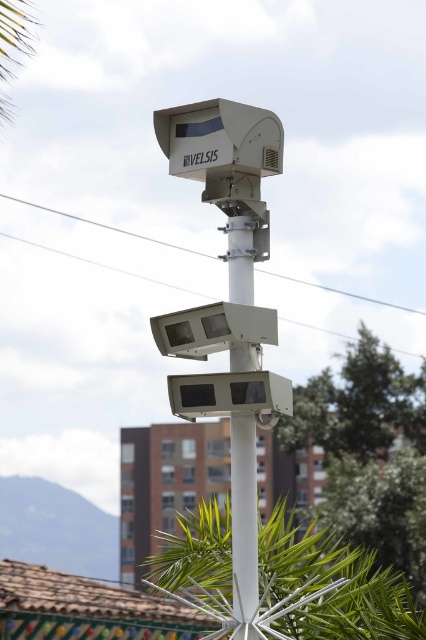
Is white matte pole at center in front of green leafy palm tree at upper left?

Yes, white matte pole at center is closer to the viewer.

Can you confirm if white matte pole at center is taller than green leafy palm tree at upper left?

Yes, white matte pole at center is taller than green leafy palm tree at upper left.

Does point (252, 449) come closer to viewer compared to point (2, 80)?

Yes, it is.

Identify the location of white matte pole at center. The width and height of the screenshot is (426, 640). (244, 524).

Does green leafy palm tree at lower center have a lesser width compared to green leafy tree at center?

Correct, green leafy palm tree at lower center's width is less than green leafy tree at center's.

What do you see at coordinates (328, 588) in the screenshot? I see `green leafy palm tree at lower center` at bounding box center [328, 588].

Image resolution: width=426 pixels, height=640 pixels. I want to click on green leafy palm tree at lower center, so click(x=328, y=588).

Is green leafy palm tree at lower center wider than green leafy palm tree at upper left?

Yes, green leafy palm tree at lower center is wider than green leafy palm tree at upper left.

Between green leafy palm tree at lower center and green leafy palm tree at upper left, which one has less height?

Standing shorter between the two is green leafy palm tree at lower center.

Which is behind, point (316, 598) or point (0, 36)?

The point (0, 36) is more distant.

Find the location of a particular element. Image resolution: width=426 pixels, height=640 pixels. green leafy palm tree at lower center is located at coordinates (328, 588).